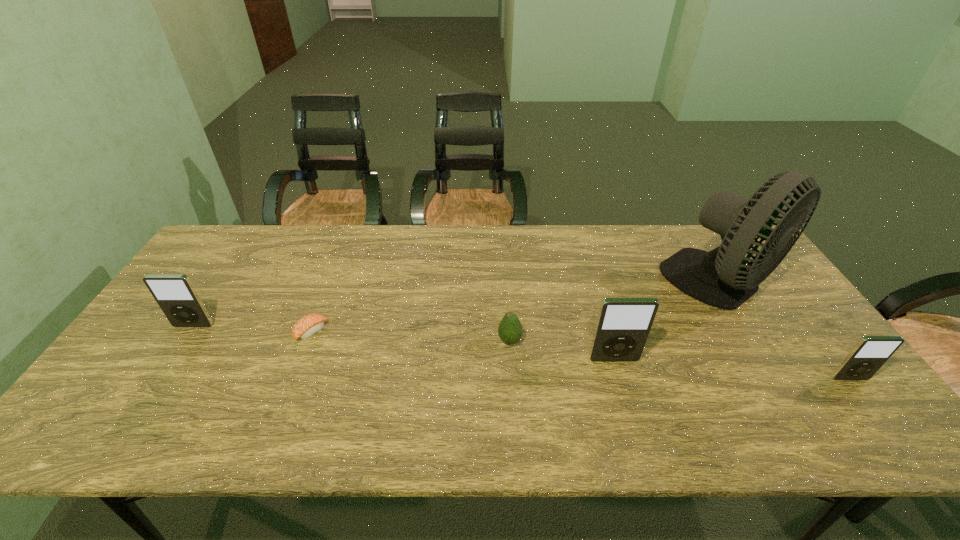
Where is `vacant space in between the farthest iPod and the rightmost iPod`? vacant space in between the farthest iPod and the rightmost iPod is located at coordinates (521, 352).

The width and height of the screenshot is (960, 540). In order to click on unoccupied position between the fan and the third object from right to left in this screenshot , I will do `click(667, 322)`.

Identify the location of vacant area that lies between the sushi and the fifth farthest object. (463, 346).

Find the location of a particular element. This screenshot has height=540, width=960. vacant area that lies between the fifth farthest object and the avocado is located at coordinates (562, 350).

Locate an element on the screen. This screenshot has height=540, width=960. free space between the farthest iPod and the fourth object from right to left is located at coordinates (351, 333).

Where is `free space that is in between the second tallest iPod and the nearest iPod`? free space that is in between the second tallest iPod and the nearest iPod is located at coordinates (521, 352).

In order to click on empty space between the fifth tallest object and the second iPod from right to left in this screenshot , I will do `click(562, 350)`.

Find the location of a particular element. The image size is (960, 540). vacant region between the second nearest object and the third object from left to right is located at coordinates (562, 350).

Choose which object is the second nearest neighbor to the second farthest iPod. Please provide its 2D coordinates. Your answer should be formatted as a tuple, i.e. [(x, y)], where the tuple contains the x and y coordinates of a point satisfying the conditions above.

[(720, 278)]

Select which object is the fourth closest to the farthest iPod. Please provide its 2D coordinates. Your answer should be formatted as a tuple, i.e. [(x, y)], where the tuple contains the x and y coordinates of a point satisfying the conditions above.

[(720, 278)]